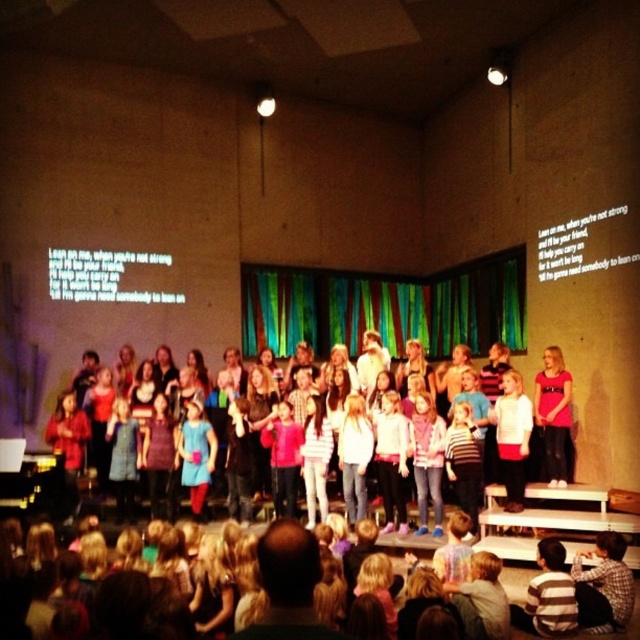
Find the location of a particular element. matte pink shirt at center is located at coordinates (554, 417).

Is point (550, 458) farther from viewer compared to point (285, 416)?

That is False.

This screenshot has height=640, width=640. I want to click on matte pink shirt at center, so point(554,417).